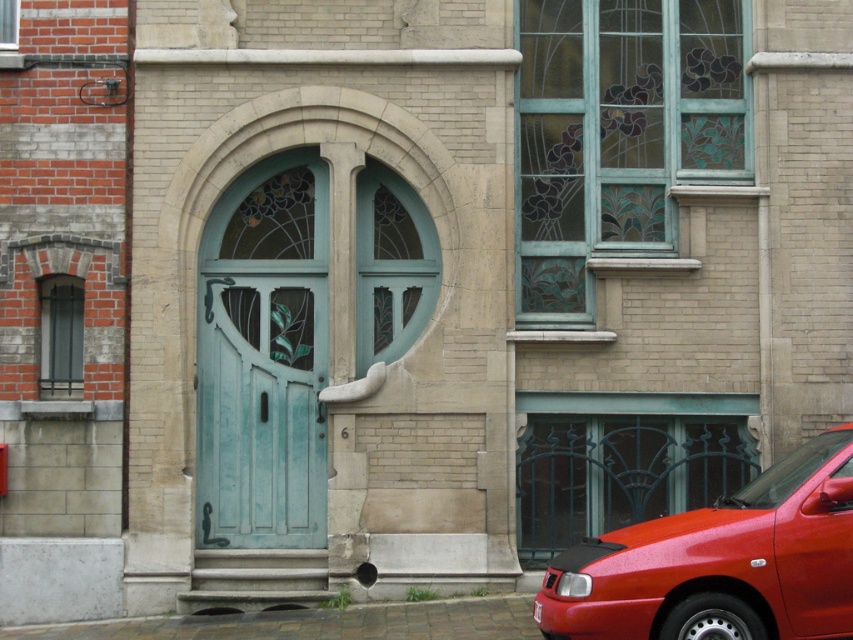
You are a delivery person trying to park your shiny red car at lower right near the teal wood door at center. The parking space requires a minimum distance of 10 feet between the car and the door. Can you safely park your car in this spot?

The shiny red car at lower right and teal wood door at center are 13.86 feet apart, which exceeds the minimum required distance of 10 feet. Therefore, you can safely park the shiny red car at lower right near the teal wood door at center.

You are a photographer trying to capture both the shiny red car at lower right and the teal wood door at center in a single frame. Given their sizes, which object should you position closer to the camera to ensure both are clearly visible?

Since the shiny red car at lower right is larger than the teal wood door at center, you should position the shiny red car at lower right farther away from the camera and bring the teal wood door at center closer. This way, both objects will appear more balanced in size within the frame.

Based on the photo, you are standing in front of the teal door with stained glass panels. You want to park your shiny red car at lower right as close as possible to the door without blocking the entrance. Where should you position the car?

The shiny red car at lower right should be positioned at point (720,563) to park as close as possible to the door without blocking the entrance.